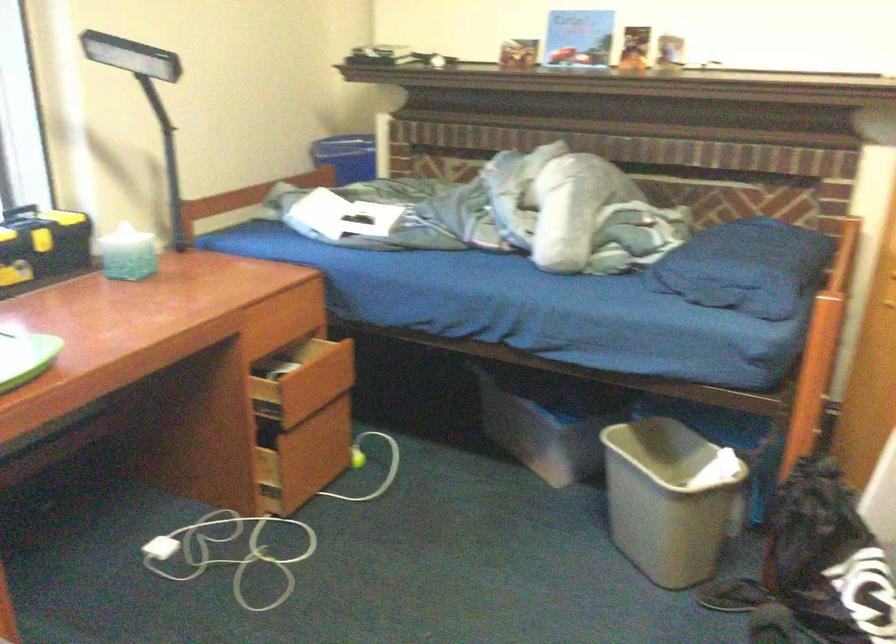
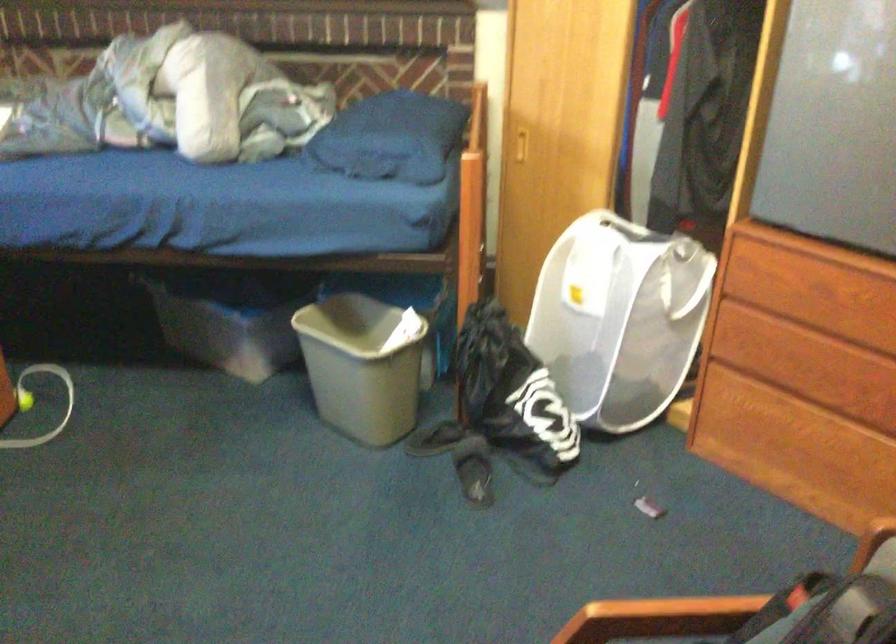
Question: The images are taken continuously from a first-person perspective. In which direction is your viewpoint rotating?

Choices:
 (A) Left
 (B) Right
 (C) Up
 (D) Down

Answer: (B)